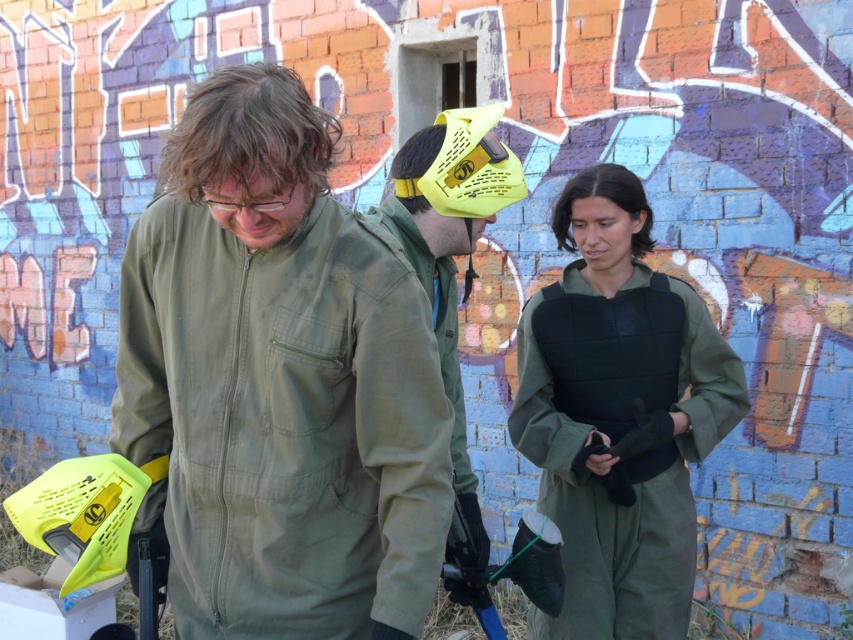
Can you confirm if green matte vest at center is positioned to the right of matte yellow helmet at center?

Correct, you'll find green matte vest at center to the right of matte yellow helmet at center.

Image resolution: width=853 pixels, height=640 pixels. What do you see at coordinates (618, 413) in the screenshot?
I see `green matte vest at center` at bounding box center [618, 413].

This screenshot has height=640, width=853. I want to click on green matte vest at center, so click(618, 413).

Can you confirm if olive green fabric jacket at center is positioned to the right of green matte vest at center?

In fact, olive green fabric jacket at center is to the left of green matte vest at center.

Which is more to the left, olive green fabric jacket at center or green matte vest at center?

olive green fabric jacket at center

This screenshot has height=640, width=853. What do you see at coordinates (279, 381) in the screenshot?
I see `olive green fabric jacket at center` at bounding box center [279, 381].

Identify the location of olive green fabric jacket at center. The height and width of the screenshot is (640, 853). (279, 381).

Which is more to the left, olive green fabric jacket at center or matte yellow helmet at center?

olive green fabric jacket at center

Is olive green fabric jacket at center taller than matte yellow helmet at center?

In fact, olive green fabric jacket at center may be shorter than matte yellow helmet at center.

Is point (199, 323) closer to camera compared to point (473, 589)?

Yes, it is in front of point (473, 589).

At what (x,y) coordinates should I click in order to perform the action: click on olive green fabric jacket at center. Please return your answer as a coordinate pair (x, y). This screenshot has width=853, height=640. Looking at the image, I should click on (279, 381).